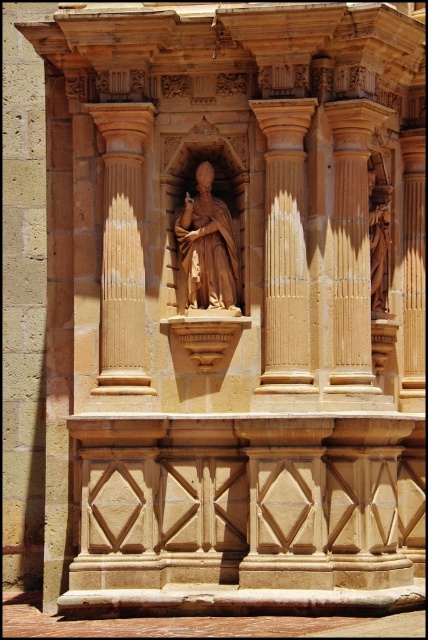
You are an architect examining the structure and need to place a support beam between the smooth stone column at right and the matte brown statue at center. Which object should the beam be closer to if it needs to be aligned with the right side of the structure?

The smooth stone column at right is to the right of the matte brown statue at center, so the support beam should be placed closer to the smooth stone column at right to align with the right side of the structure.